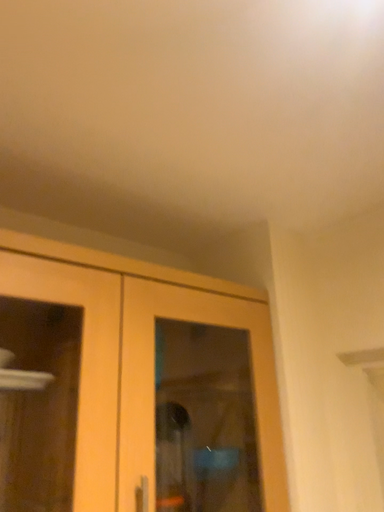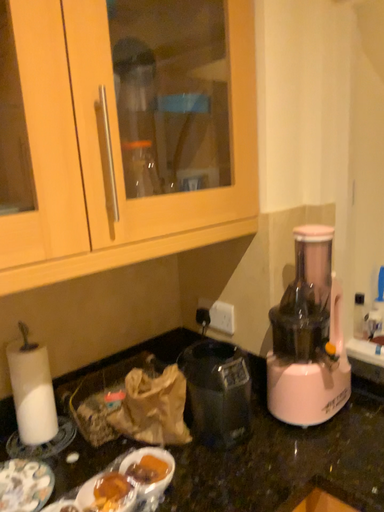
Question: Which way did the camera rotate in the video?

Choices:
 (A) rotated downward
 (B) rotated upward

Answer: (A)